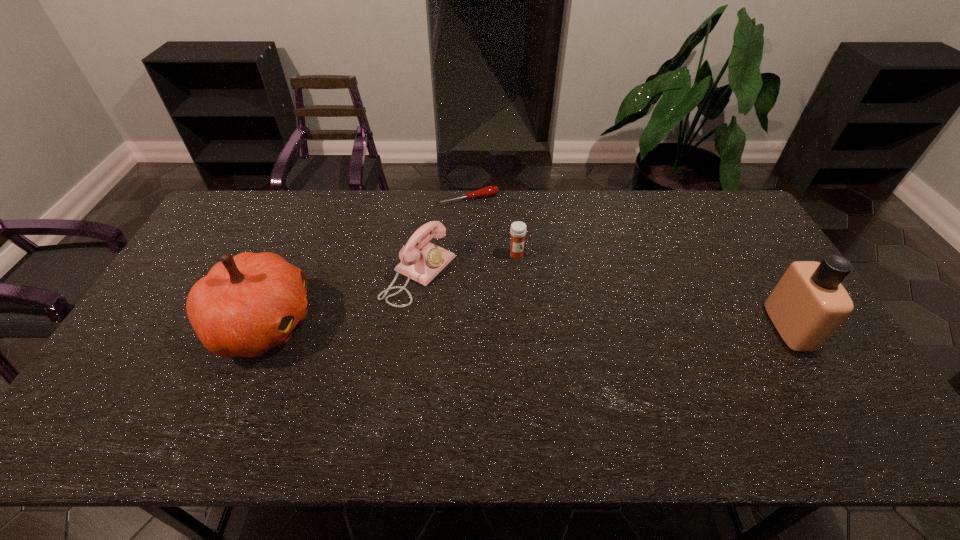
Where is `free region at the far edge of the desktop`? free region at the far edge of the desktop is located at coordinates (566, 219).

This screenshot has width=960, height=540. I want to click on blank space at the near edge of the desktop, so click(625, 375).

In the image, there is a desktop. What are the coordinates of `vacant space at the right edge` in the screenshot? It's located at click(x=746, y=248).

Identify the location of vacant space at the far right corner of the desktop. (717, 211).

This screenshot has height=540, width=960. Identify the location of vacant space that's between the perfume and the second object from right to left. (653, 291).

Where is `free area in between the screwdriver and the medicine`? This screenshot has width=960, height=540. free area in between the screwdriver and the medicine is located at coordinates (492, 227).

Image resolution: width=960 pixels, height=540 pixels. I want to click on vacant region between the medicine and the shortest object, so click(x=492, y=227).

Identify the location of free space between the perfume and the third shortest object. (605, 300).

Locate an element on the screen. The image size is (960, 540). vacant space in between the leftmost object and the perfume is located at coordinates (526, 325).

Where is `free space between the leftmost object and the third tallest object`? free space between the leftmost object and the third tallest object is located at coordinates (341, 299).